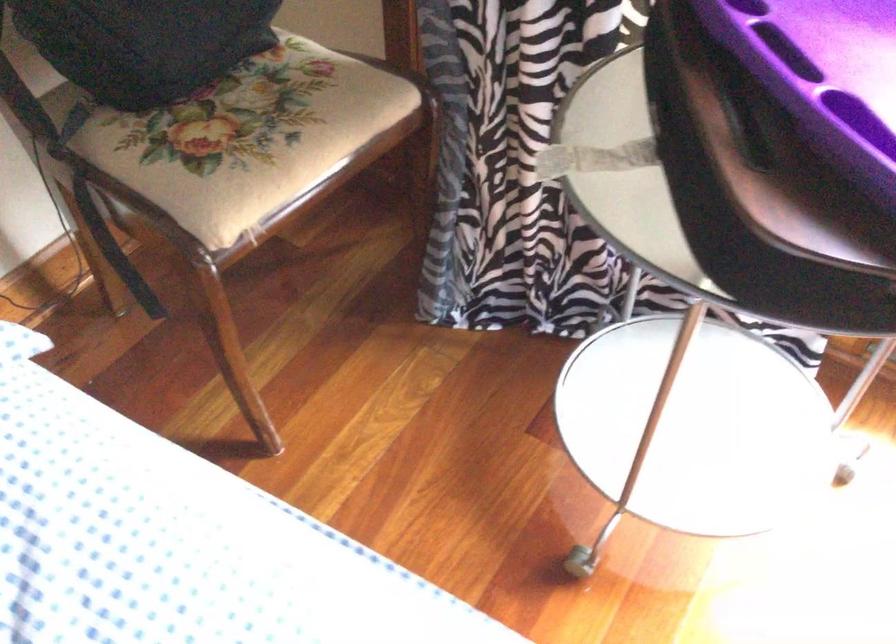
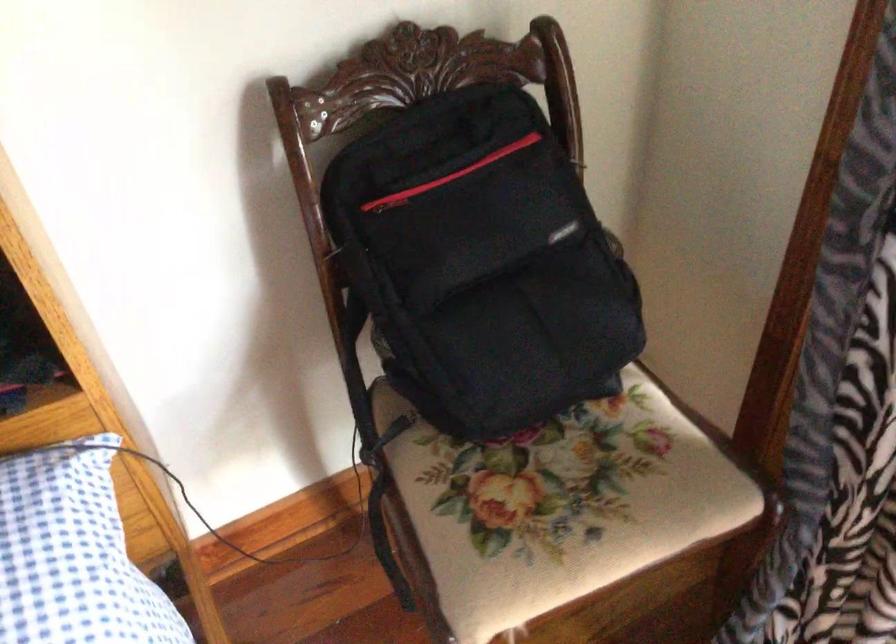
Locate, in the second image, the point that corresponds to pixel 254 128 in the first image.

(556, 506)